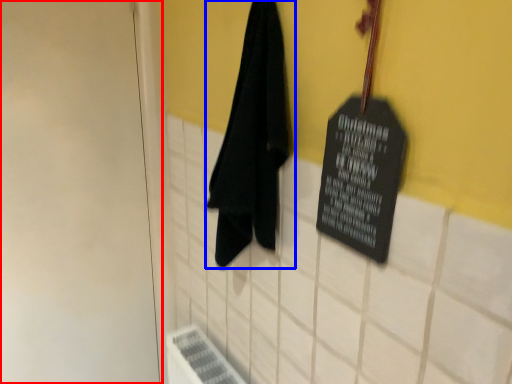
Question: Among these objects, which one is nearest to the camera, door (highlighted by a red box) or towel (highlighted by a blue box)?

Choices:
 (A) door
 (B) towel

Answer: (B)